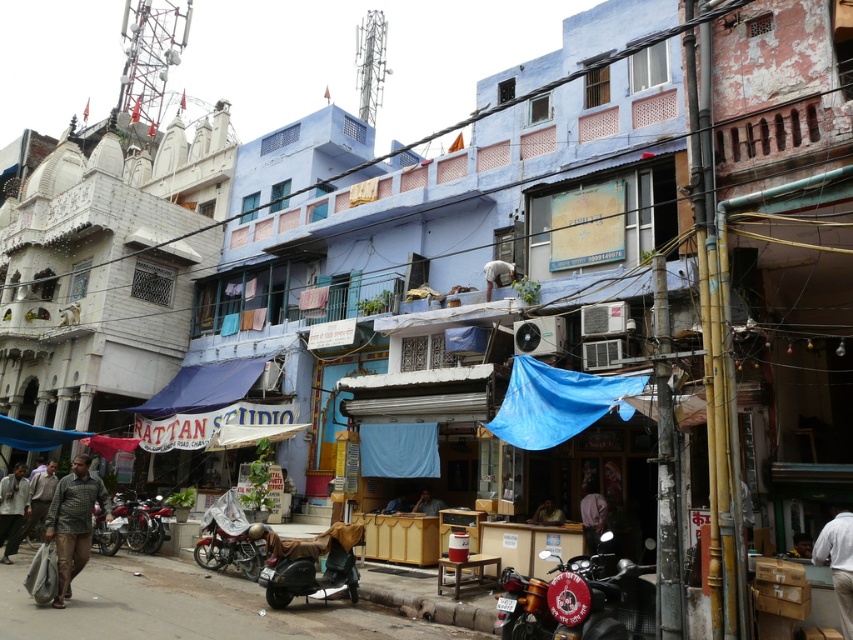
You are a customer in a clothing store and see the light gray fabric pants at lower right and the light brown leather jacket at lower right. Which item takes up less space on the rack?

The light gray fabric pants at lower right takes up less space on the rack because it is smaller than the light brown leather jacket at lower right.

You are a customer looking to purchase clothing items in the store. You see the light gray fabric pants at lower right and the light brown leather jacket at lower right. Which item is easier to reach without moving from your current position?

The light gray fabric pants at lower right is closer to the viewer than the light brown leather jacket at lower right, so it is easier to reach without moving.

You are a delivery person trying to navigate through the narrow street. You see a dark gray matte scooter at center and a dark purple fabric at center. Which object is closer to the left side of the street?

The dark gray matte scooter at center is positioned on the left side of dark purple fabric at center, so it is closer to the left side of the street.